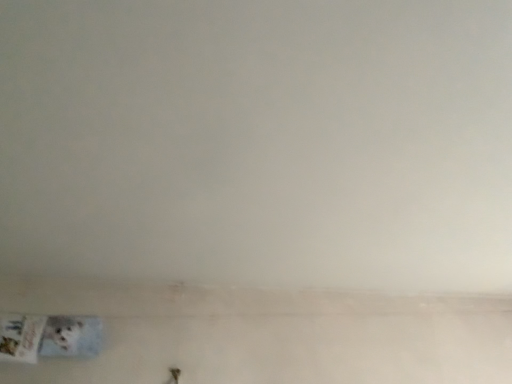
What are the coordinates of `white plush dog at lower left` in the screenshot? It's located at (62, 335).

What do you see at coordinates (62, 335) in the screenshot? This screenshot has height=384, width=512. I see `white plush dog at lower left` at bounding box center [62, 335].

Identify the location of white plush dog at lower left. (62, 335).